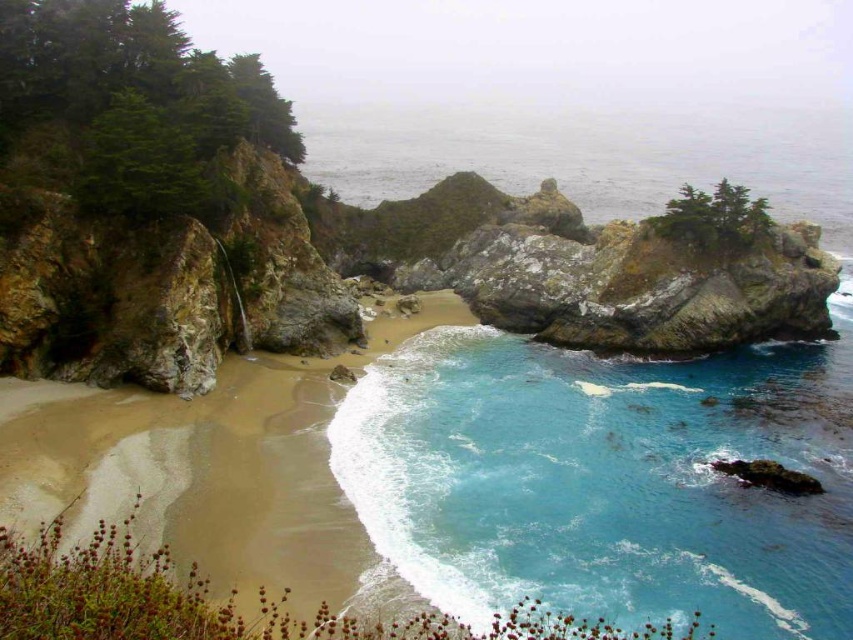
You are standing on the beach looking at the rocky outcrop. There are two points marked on the image. The first point is at coordinates point (343, 440) and the second is at point (291, 429). Which of these points is closer to you, the observer?

Point (343, 440) is in front of point (291, 429), so it is closer to you.

You are standing on the sandy beach at center and want to reach the blue smooth water at center. Which direction should you walk to get there?

The blue smooth water at center is positioned on the right side of sandy beach at center, so you should walk to the right to reach it.